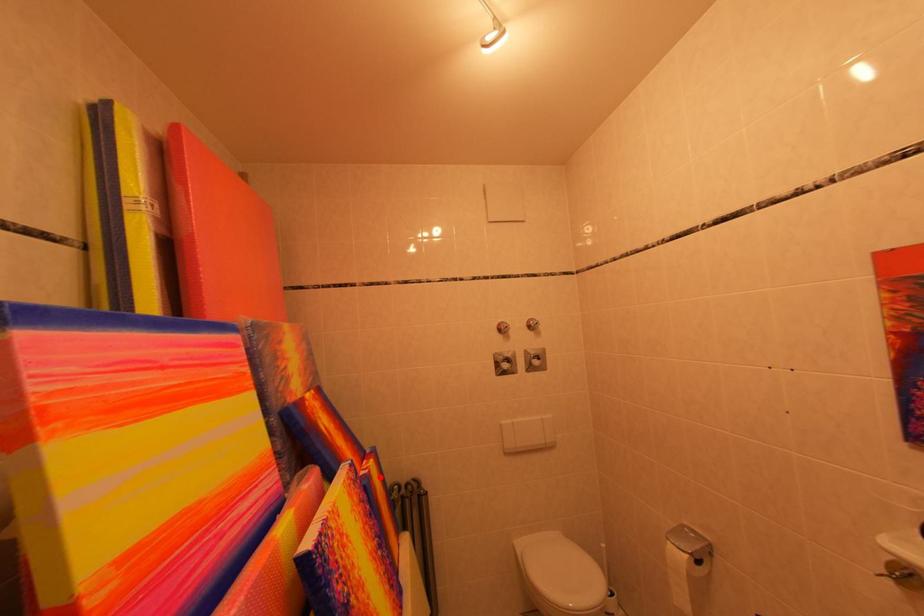
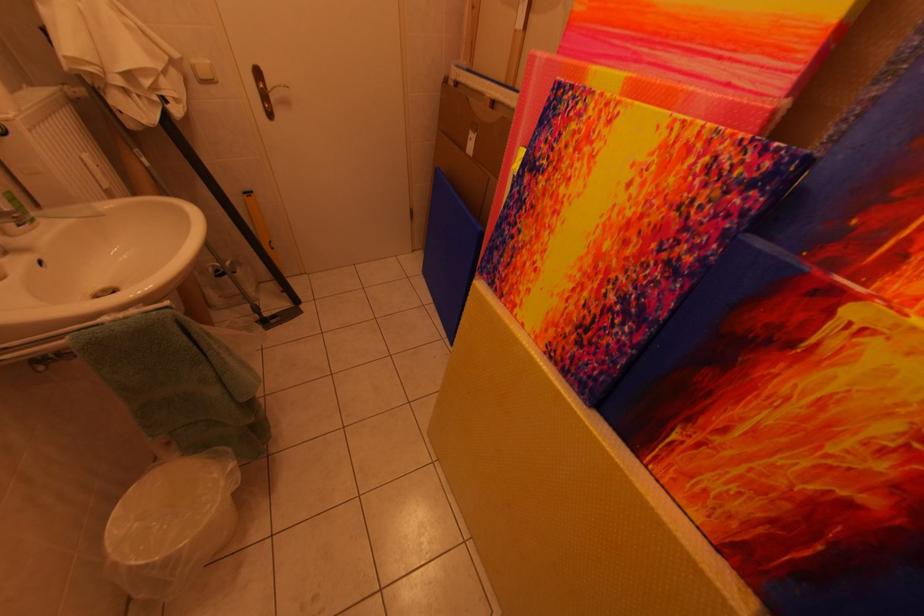
In the second image, find the point that corresponds to the highlighted location in the first image.

(861, 317)